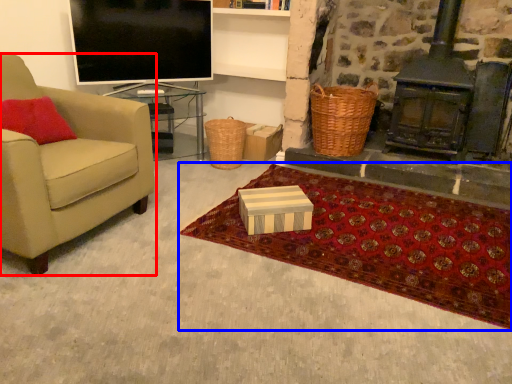
Question: Which point is further to the camera, chair (highlighted by a red box) or mat (highlighted by a blue box)?

Choices:
 (A) chair
 (B) mat

Answer: (B)